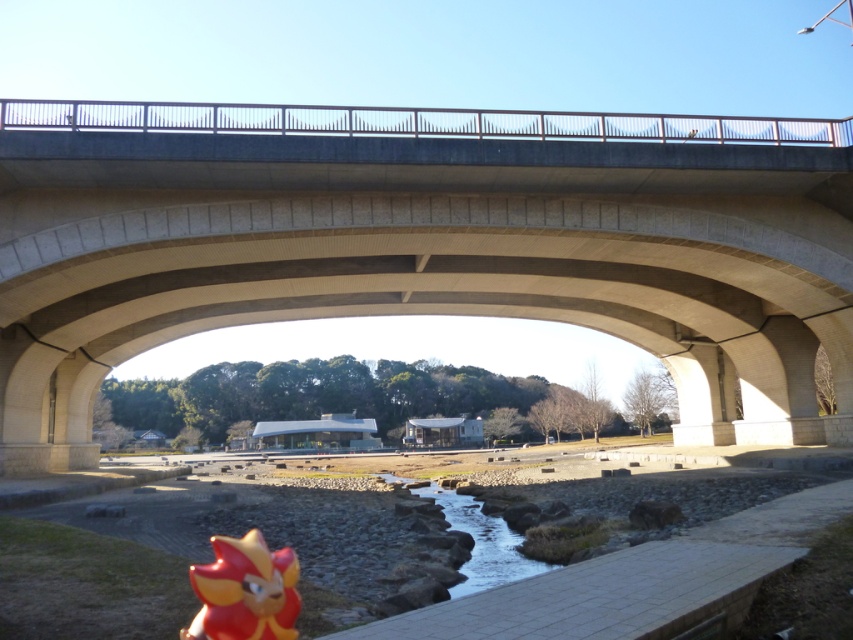
You are standing on the bridge and want to determine which of the two points, point (x=221, y=547) or point (x=465, y=525), is closer to you. Based on the scene, which point is nearer?

Point (x=221, y=547) is closer to the viewer than point (x=465, y=525).

You are standing at the center of the image and want to find the concrete bridge at upper center. In which direction should you look?

The concrete bridge at upper center is located at point 0.383 on the x axis and 0.496 on the y axis, so you should look slightly to the left and upwards from the center of the image.